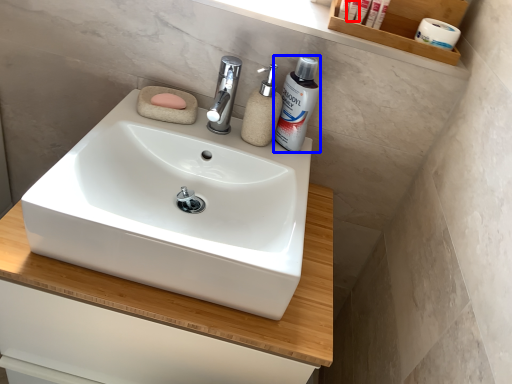
Question: Which object is closer to the camera taking this photo, toiletry (highlighted by a red box) or shaving cream (highlighted by a blue box)?

Choices:
 (A) toiletry
 (B) shaving cream

Answer: (B)